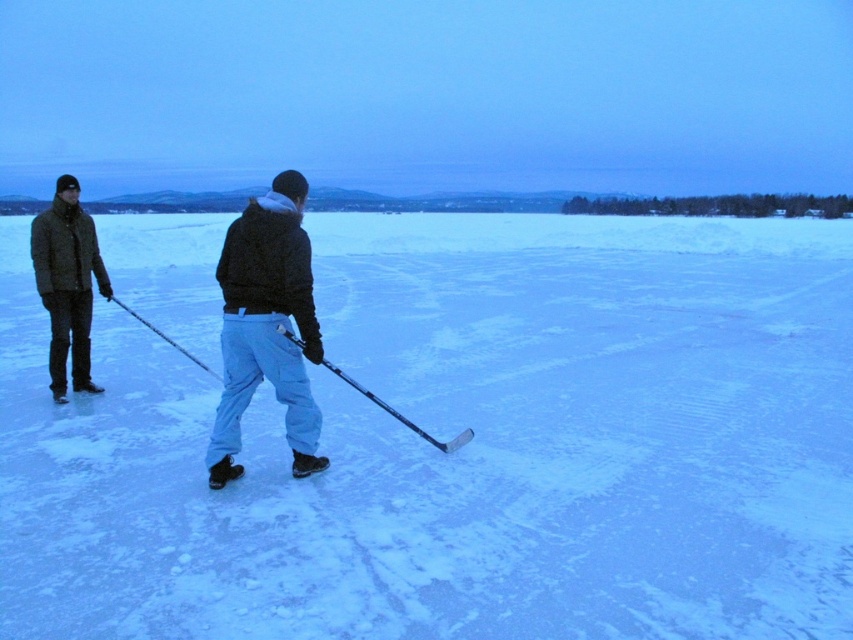
Does dark green jacket at left appear under black glossy hockey stick at center?

No, dark green jacket at left is not below black glossy hockey stick at center.

Does point (86, 221) come farther from viewer compared to point (450, 451)?

Yes.

Between point (61, 244) and point (466, 435), which one is positioned behind?

The point (61, 244) is behind.

Where is `dark green jacket at left`? The height and width of the screenshot is (640, 853). dark green jacket at left is located at coordinates (67, 284).

Does point (111, 512) come farther from viewer compared to point (252, 220)?

No, (111, 512) is in front of (252, 220).

Is white matte snow at center taller than black matte jacket at center?

Answer: Indeed, white matte snow at center has a greater height compared to black matte jacket at center.

Which is behind, point (132, 509) or point (299, 458)?

The point (299, 458) is more distant.

I want to click on white matte snow at center, so click(462, 448).

Locate an element on the screen. Image resolution: width=853 pixels, height=640 pixels. black matte jacket at center is located at coordinates (265, 326).

Who is higher up, black matte jacket at center or dark green jacket at left?

dark green jacket at left is higher up.

Which is in front, point (300, 240) or point (45, 230)?

Point (300, 240) is more forward.

At what (x,y) coordinates should I click in order to perform the action: click on black matte jacket at center. Please return your answer as a coordinate pair (x, y). This screenshot has width=853, height=640. Looking at the image, I should click on (265, 326).